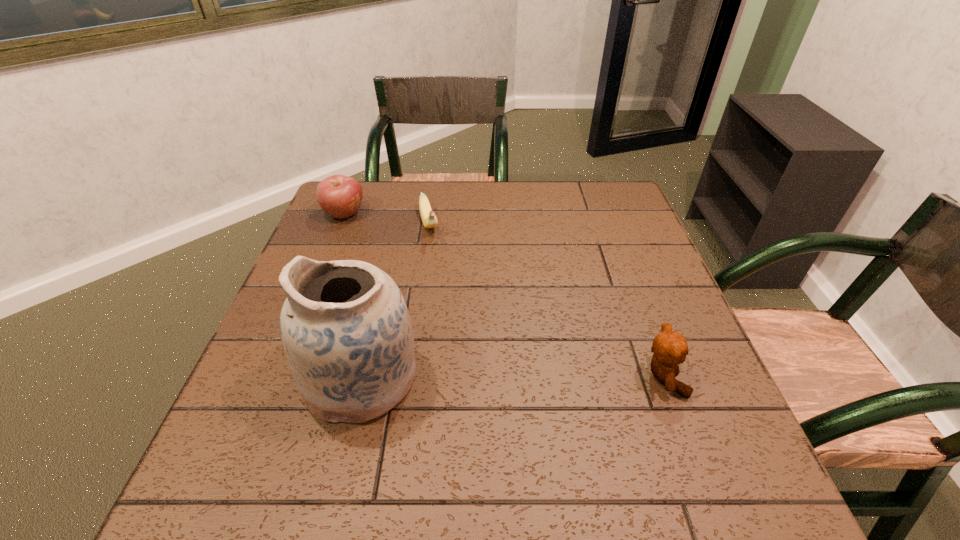
Identify the location of vacant space positioned on the side of the apple with the unique marking. The width and height of the screenshot is (960, 540). (390, 258).

Find the location of a particular element. This screenshot has width=960, height=540. free space located 0.250m on the side of the apple with the unique marking is located at coordinates (400, 267).

This screenshot has height=540, width=960. In order to click on banana that is at the far edge in this screenshot , I will do `click(429, 219)`.

This screenshot has height=540, width=960. Identify the location of apple located at the far edge. (340, 196).

Where is `object located at the near edge`? object located at the near edge is located at coordinates click(x=345, y=327).

This screenshot has width=960, height=540. I want to click on pottery situated at the left edge, so click(x=345, y=327).

You are a GUI agent. You are given a task and a screenshot of the screen. Output one action in this format:
    pyautogui.click(x=<x>, y=<y>)
    Task: Click on the apple located in the left edge section of the desktop
    
    Given the screenshot: What is the action you would take?
    pyautogui.click(x=340, y=196)

Where is `object located in the right edge section of the desktop`? This screenshot has width=960, height=540. object located in the right edge section of the desktop is located at coordinates (670, 348).

Where is `object that is at the far left corner`? The width and height of the screenshot is (960, 540). object that is at the far left corner is located at coordinates (340, 196).

You are a GUI agent. You are given a task and a screenshot of the screen. Output one action in this format:
    pyautogui.click(x=<x>, y=<y>)
    Task: Click on the object positioned at the near left corner
    Image resolution: width=960 pixels, height=540 pixels.
    Given the screenshot: What is the action you would take?
    pyautogui.click(x=345, y=327)